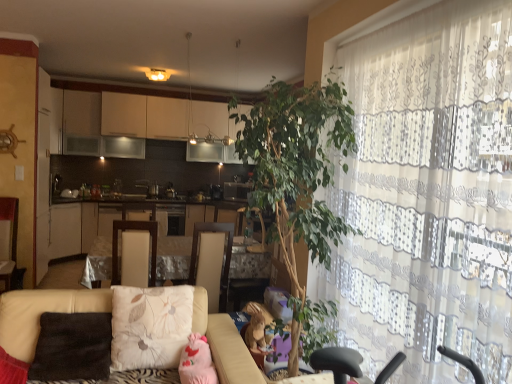
How much space does pink plush toy at lower center, which is counted as the second toy, starting from the back, occupy horizontally?

It is 23.98 inches.

Image resolution: width=512 pixels, height=384 pixels. In order to click on wooden swivel chair at center, placed as the first swivel chair when sorted from left to right in this screenshot , I will do click(x=134, y=253).

What do you see at coordinates (236, 190) in the screenshot?
I see `satin silver microwave at center` at bounding box center [236, 190].

This screenshot has width=512, height=384. Find the location of `fluffy beige pillow at center, positioned as the second pillow in left-to-right order`. fluffy beige pillow at center, positioned as the second pillow in left-to-right order is located at coordinates (150, 326).

Where is `brown fabric pillow at lower left, marked as the 1th pillow in a left-to-right arrangement`? Image resolution: width=512 pixels, height=384 pixels. brown fabric pillow at lower left, marked as the 1th pillow in a left-to-right arrangement is located at coordinates (72, 347).

What is the approximate width of beige fabric swivel chair at center, marked as the 2th swivel chair in a left-to-right arrangement?

It is 22.50 inches.

In order to face beige fabric swivel chair at center, the first swivel chair positioned from the right, should I rotate leftwards or rightwards?

Turn left approximately 7.025 degrees to face it.

The width and height of the screenshot is (512, 384). I want to click on white glossy cabinets at center, so (x=79, y=226).

Is white glossy cabinets at center taller than brown fabric pillow at lower left, marked as the 1th pillow in a left-to-right arrangement?

Yes.

From the image's perspective, between white glossy cabinets at center and brown fabric pillow at lower left, the second pillow from the right, which one is located above?

white glossy cabinets at center appears higher in the image.

Is white glossy cabinets at center aimed at brown fabric pillow at lower left, marked as the 1th pillow in a left-to-right arrangement?

Yes.

Can you confirm if white glossy cabinets at center is positioned to the right of brown fabric pillow at lower left, the second pillow from the right?

No, white glossy cabinets at center is not to the right of brown fabric pillow at lower left, the second pillow from the right.

Find the location of a particular element. This screenshot has height=384, width=512. studio couch on the right of brown fabric pillow at lower left, the second pillow from the right is located at coordinates (41, 313).

Could you tell me if brown fabric pillow at lower left, the second pillow from the right, is turned towards beige fabric couch at lower left?

Yes, brown fabric pillow at lower left, the second pillow from the right, is oriented towards beige fabric couch at lower left.

Is brown fabric pillow at lower left, marked as the 1th pillow in a left-to-right arrangement, positioned before beige fabric couch at lower left?

No, it is not.

Is green leafy plant at center surrounding satin silver microwave at center?

No.

Measure the distance from green leafy plant at center to satin silver microwave at center.

7.40 feet.

Is green leafy plant at center turned away from satin silver microwave at center?

green leafy plant at center does not have its back to satin silver microwave at center.

Which object is further away from the camera taking this photo, green leafy plant at center or satin silver microwave at center?

satin silver microwave at center is behind.

Does pink plush toy at lower center, which is the first toy in front-to-back order, come in front of satin black dishwasher at center?

Yes, it is.

Would you say pink plush toy at lower center, positioned as the 2th toy in right-to-left order, contains satin black dishwasher at center?

No.

Find the location of a particular element. The width and height of the screenshot is (512, 384). toy that is the 2nd one when counting downward from the satin black dishwasher at center (from the image's perspective) is located at coordinates (197, 362).

Considering the relative positions of pink plush toy at lower center, which is counted as the second toy, starting from the back, and satin black dishwasher at center in the image provided, is pink plush toy at lower center, which is counted as the second toy, starting from the back, to the right of satin black dishwasher at center from the viewer's perspective?

Indeed, pink plush toy at lower center, which is counted as the second toy, starting from the back, is positioned on the right side of satin black dishwasher at center.

Do you think fluffy beige pillow at center, which is counted as the first pillow, starting from the right, is within pink plush toy at lower center, positioned as the first toy in left-to-right order, or outside of it?

fluffy beige pillow at center, which is counted as the first pillow, starting from the right, is located beyond the bounds of pink plush toy at lower center, positioned as the first toy in left-to-right order.

Which pillow is the 1st one when counting from the left side of the pink plush toy at lower center, positioned as the 2th toy in right-to-left order? Please provide its 2D coordinates.

[(150, 326)]

Considering the relative sizes of fluffy beige pillow at center, positioned as the second pillow in left-to-right order, and pink plush toy at lower center, positioned as the first toy in left-to-right order, in the image provided, is fluffy beige pillow at center, positioned as the second pillow in left-to-right order, shorter than pink plush toy at lower center, positioned as the first toy in left-to-right order,?

Incorrect, the height of fluffy beige pillow at center, positioned as the second pillow in left-to-right order, does not fall short of that of pink plush toy at lower center, positioned as the first toy in left-to-right order.

From a real-world perspective, is fluffy beige pillow at center, positioned as the second pillow in left-to-right order, physically located above or below pink plush toy at lower center, which is counted as the second toy, starting from the back?

fluffy beige pillow at center, positioned as the second pillow in left-to-right order, is above pink plush toy at lower center, which is counted as the second toy, starting from the back.

Is beige fabric couch at lower left smaller than beige fabric swivel chair at center, marked as the 2th swivel chair in a left-to-right arrangement?

No.

Is beige fabric couch at lower left next to beige fabric swivel chair at center, marked as the 2th swivel chair in a left-to-right arrangement?

They are not placed beside each other.

Where is `studio couch that is in front of the beige fabric swivel chair at center, the first swivel chair positioned from the right`? The height and width of the screenshot is (384, 512). studio couch that is in front of the beige fabric swivel chair at center, the first swivel chair positioned from the right is located at coordinates (41, 313).

Is beige fabric couch at lower left oriented away from pink plush toy at lower center, which is the first toy in front-to-back order?

beige fabric couch at lower left does not have its back to pink plush toy at lower center, which is the first toy in front-to-back order.

Looking at the image, does beige fabric couch at lower left seem bigger or smaller compared to pink plush toy at lower center, which is the first toy in front-to-back order?

beige fabric couch at lower left is bigger than pink plush toy at lower center, which is the first toy in front-to-back order.

Does beige fabric couch at lower left contain pink plush toy at lower center, positioned as the 2th toy in right-to-left order?

Indeed, pink plush toy at lower center, positioned as the 2th toy in right-to-left order, is located within beige fabric couch at lower left.

Identify the location of the 1st pillow counting from the right of the white glossy cabinets at center. This screenshot has width=512, height=384. (72, 347).

The height and width of the screenshot is (384, 512). Identify the location of pillow located on the left of beige fabric couch at lower left. point(72,347).

Which object lies nearer to the anchor point satin silver microwave at center, brown fabric pillow at lower left, the second pillow from the right, or beige fabric couch at lower left?

beige fabric couch at lower left is positioned closer to the anchor satin silver microwave at center.

When comparing their distances from fluffy beige pillow at center, which is counted as the first pillow, starting from the right, does white glossy cabinets at center or satin black dishwasher at center seem closer?

Among the two, satin black dishwasher at center is located nearer to fluffy beige pillow at center, which is counted as the first pillow, starting from the right.

When comparing their distances from brown plush toy at lower center, which appears as the 1th toy when viewed from the right, does beige fabric couch at lower left or pink plush toy at lower center, positioned as the first toy in left-to-right order, seem closer?

beige fabric couch at lower left lies closer to brown plush toy at lower center, which appears as the 1th toy when viewed from the right, than the other object.

When comparing their distances from satin black dishwasher at center, does brown plush toy at lower center, the first toy positioned from the back, or beige fabric couch at lower left seem further?

beige fabric couch at lower left lies further to satin black dishwasher at center than the other object.

Based on their spatial positions, is white glossy cabinets at center or fluffy beige pillow at center, positioned as the second pillow in left-to-right order, further from beige fabric swivel chair at center, marked as the 2th swivel chair in a left-to-right arrangement?

white glossy cabinets at center.

Based on their spatial positions, is white glossy cabinets at center or green leafy plant at center further from fluffy beige pillow at center, positioned as the second pillow in left-to-right order?

white glossy cabinets at center is positioned further to the anchor fluffy beige pillow at center, positioned as the second pillow in left-to-right order.

Which object lies further to the anchor point wooden swivel chair at center, which is the 2th swivel chair from right to left, white glossy cabinets at center or pink plush toy at lower center, which is the first toy in front-to-back order?

white glossy cabinets at center.

From the image, which object appears to be farther from white glossy cabinets at center, satin black dishwasher at center or brown fabric pillow at lower left, marked as the 1th pillow in a left-to-right arrangement?

Based on the image, brown fabric pillow at lower left, marked as the 1th pillow in a left-to-right arrangement, appears to be further to white glossy cabinets at center.

Image resolution: width=512 pixels, height=384 pixels. In order to click on toy between brown fabric pillow at lower left, the second pillow from the right, and white glossy cabinets at center from front to back in this screenshot , I will do `click(257, 327)`.

Image resolution: width=512 pixels, height=384 pixels. I want to click on toy between green leafy plant at center and beige fabric swivel chair at center, marked as the 2th swivel chair in a left-to-right arrangement, in the front-back direction, so click(257, 327).

At what (x,y) coordinates should I click in order to perform the action: click on studio couch located between brown fabric pillow at lower left, the second pillow from the right, and green leafy plant at center in the left-right direction. Please return your answer as a coordinate pair (x, y). The image size is (512, 384). Looking at the image, I should click on (41, 313).

Identify the location of toy located between fluffy beige pillow at center, which is counted as the first pillow, starting from the right, and wooden swivel chair at center, which is the 2th swivel chair from right to left, in the depth direction. The image size is (512, 384). (257, 327).